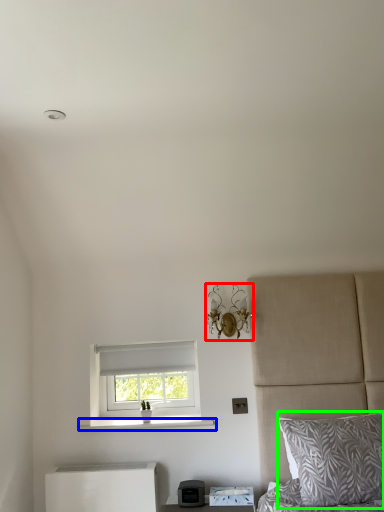
Question: Which object is the closest to the light fixture (highlighted by a red box)? Choose among these: window sill (highlighted by a blue box) or pillow (highlighted by a green box).

Choices:
 (A) window sill
 (B) pillow

Answer: (A)